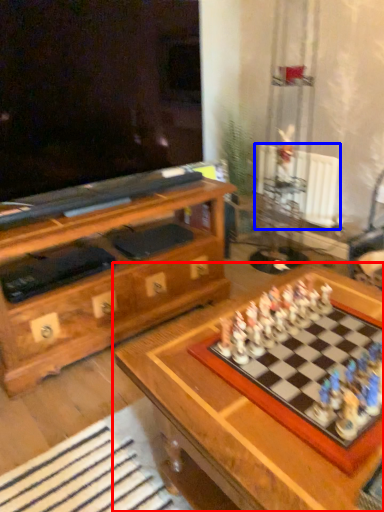
Question: Which point is closer to the camera, table (highlighted by a red box) or radiator (highlighted by a blue box)?

Choices:
 (A) table
 (B) radiator

Answer: (A)